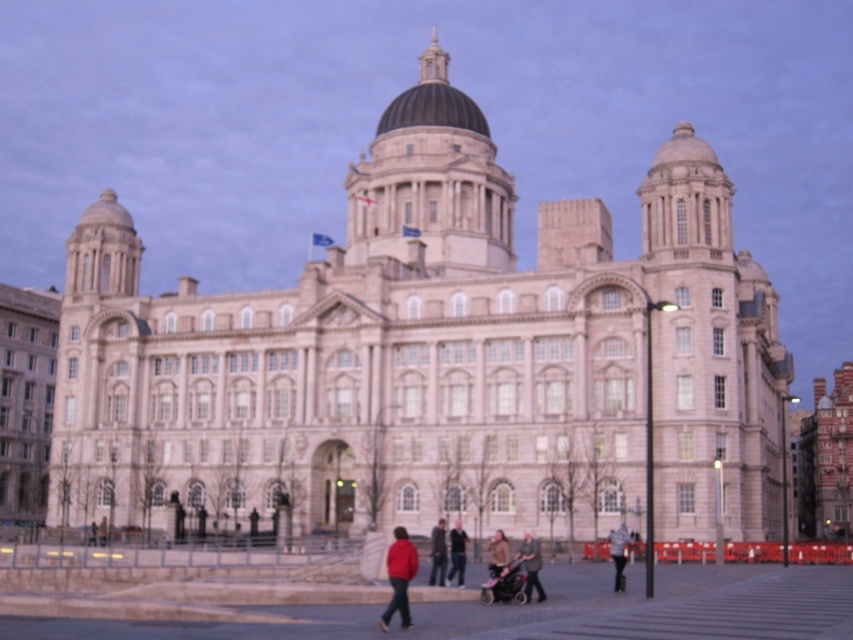
Is point (730, 227) farther from viewer compared to point (459, 563)?

Yes, it is behind point (459, 563).

Is white stone building at center positioned behind red jacket at center?

No.

Between point (737, 480) and point (463, 561), which one is positioned behind?

The point (737, 480) is behind.

This screenshot has width=853, height=640. Identify the location of white stone building at center. (437, 356).

Which is below, dark gray fabric jacket at center or brown leather jacket at center?

brown leather jacket at center is lower down.

Is dark gray fabric jacket at center wider than brown leather jacket at center?

Yes, dark gray fabric jacket at center is wider than brown leather jacket at center.

At what (x,y) coordinates should I click in order to perform the action: click on dark gray fabric jacket at center. Please return your answer as a coordinate pair (x, y). This screenshot has width=853, height=640. Looking at the image, I should click on (531, 564).

Is white stone building at center positioned in front of brown leather jacket at center?

No, white stone building at center is further to the viewer.

Is white stone building at center to the right of brown leather jacket at center from the viewer's perspective?

Incorrect, white stone building at center is not on the right side of brown leather jacket at center.

I want to click on white stone building at center, so click(437, 356).

Where is `white stone building at center`? white stone building at center is located at coordinates (437, 356).